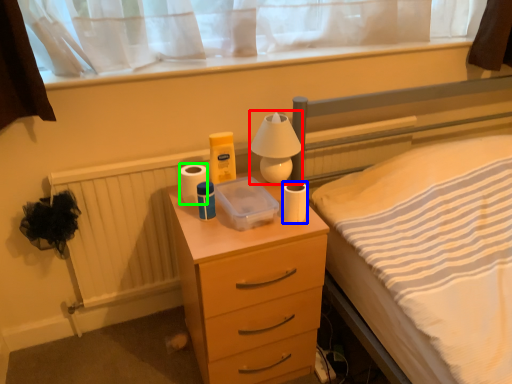
Question: Based on their relative distances, which object is farther from bedside lamp (highlighted by a red box)? Choose from toilet paper (highlighted by a blue box) and toilet paper (highlighted by a green box).

Choices:
 (A) toilet paper
 (B) toilet paper

Answer: (B)